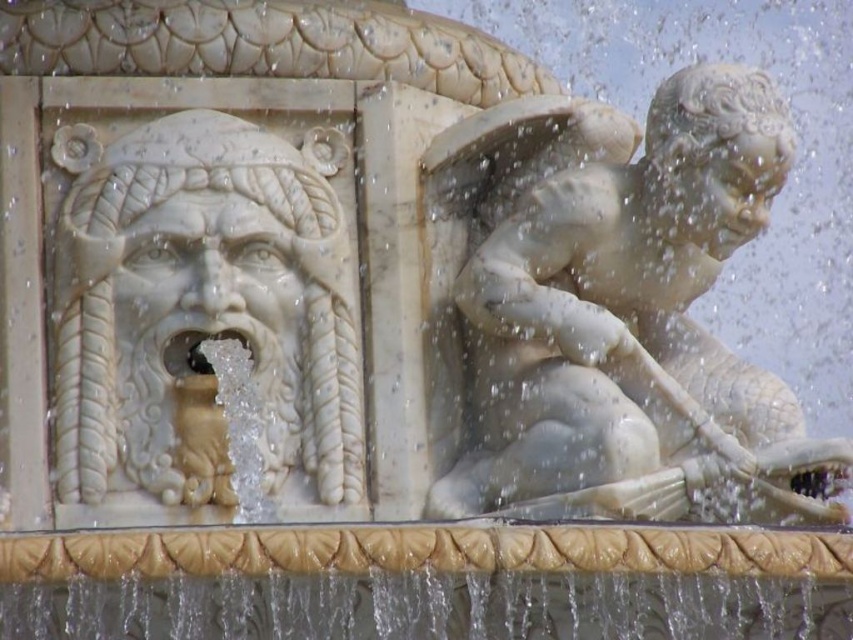
Question: Does white marble statue at right lie in front of white marble face at left?

Choices:
 (A) no
 (B) yes

Answer: (B)

Question: In this image, where is white marble statue at right located relative to white marble face at left?

Choices:
 (A) below
 (B) above

Answer: (A)

Question: Is white marble statue at right below white marble face at left?

Choices:
 (A) yes
 (B) no

Answer: (A)

Question: Which of the following is the closest to the observer?

Choices:
 (A) (199, 168)
 (B) (505, 348)

Answer: (A)